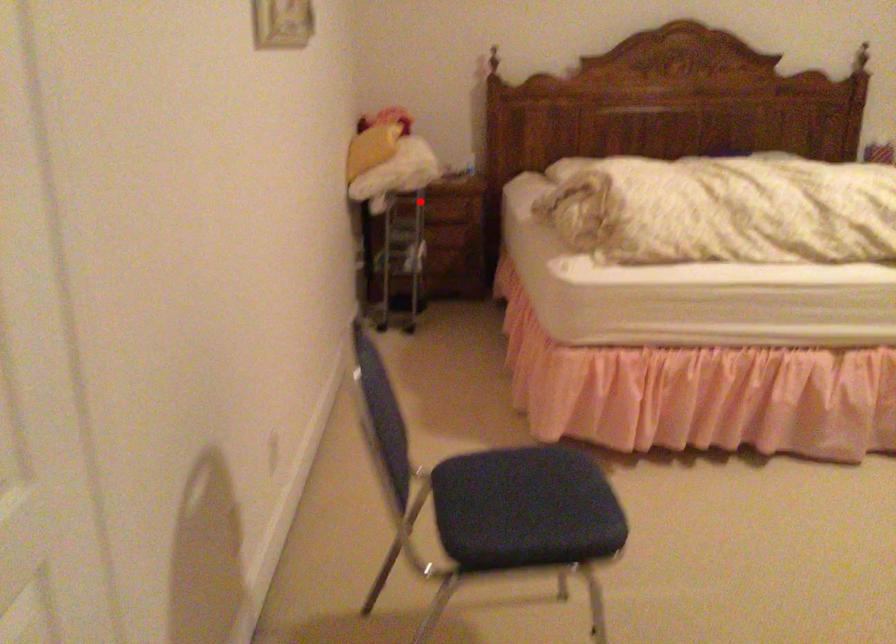
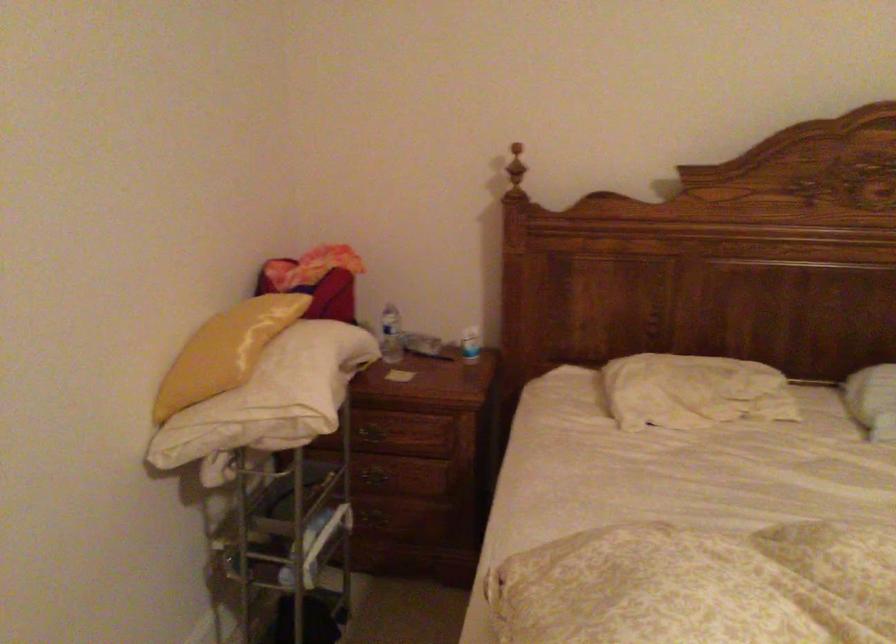
Question: A red point is marked in image1. In image2, is the corresponding 3D point closer to the camera or farther? Reply with the corresponding letter.

Choices:
 (A) The corresponding 3D point is closer.
 (B) The corresponding 3D point is farther.

Answer: (A)